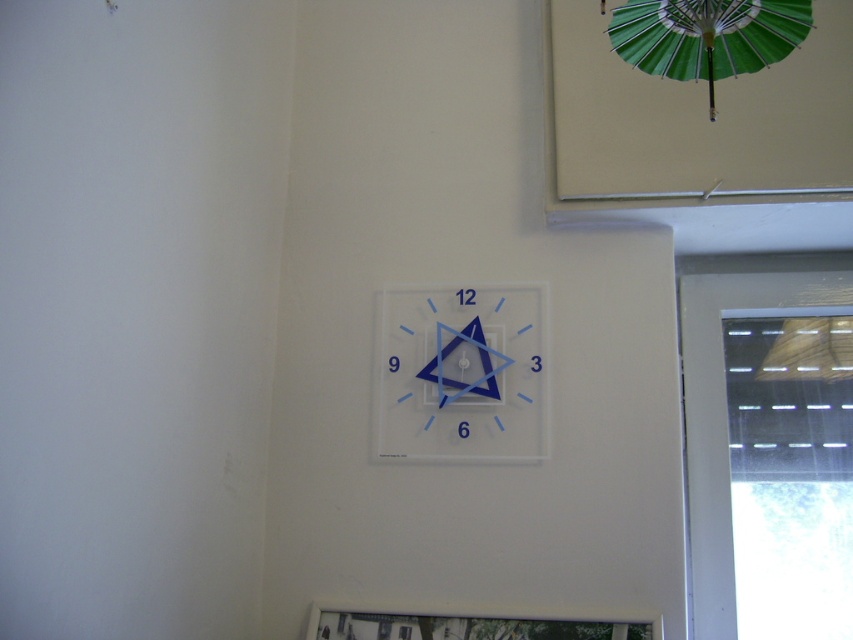
You are trying to hang a new picture frame that is 1 meter wide. You want to place it between the transparent plastic clock at center and the green paper umbrella at upper right. Based on their widths, will there be enough space for the frame?

The transparent plastic clock at center might be wider than green paper umbrella at upper right. Since the clock could be wider, the total width between them may vary. Without exact measurements, it is uncertain if the 1 meter wide frame will fit. Consider measuring the space first.

You are standing in the room looking at the wall. There are two points marked on the wall, one at point coordinates point (398, 355) and another at point (741, 8). Which point is closer to you?

Point (398, 355) is further to the camera than point (741, 8), so the point closer to you is point (741, 8).

You are hanging a new picture frame that needs to be placed exactly between the transparent plastic clock at center and the green paper umbrella at upper right. Based on their current positions, where should you place the picture frame?

The transparent plastic clock at center is positioned on the left side of green paper umbrella at upper right, so placing the picture frame exactly between them would require positioning it halfway between the transparent plastic clock at center and the green paper umbrella at upper right along the horizontal axis.